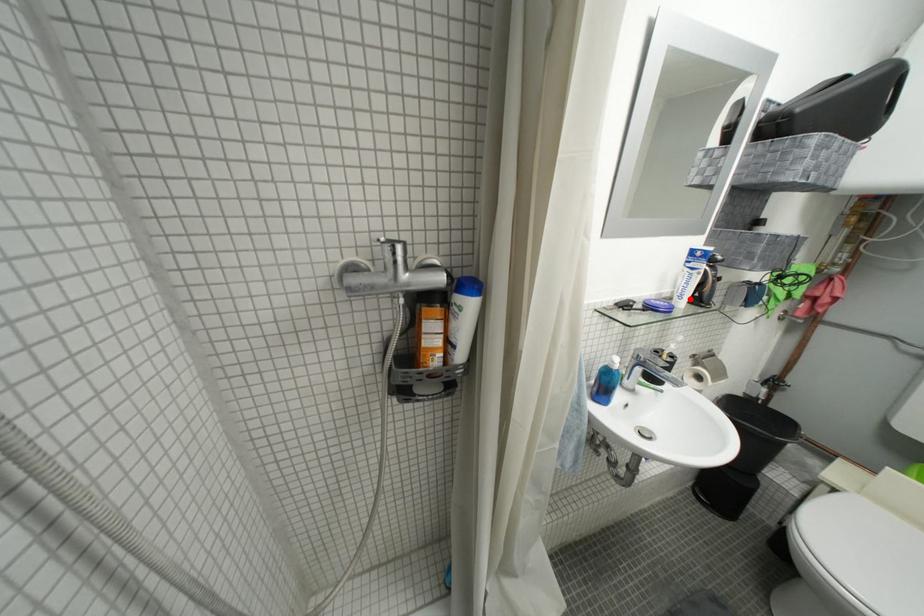
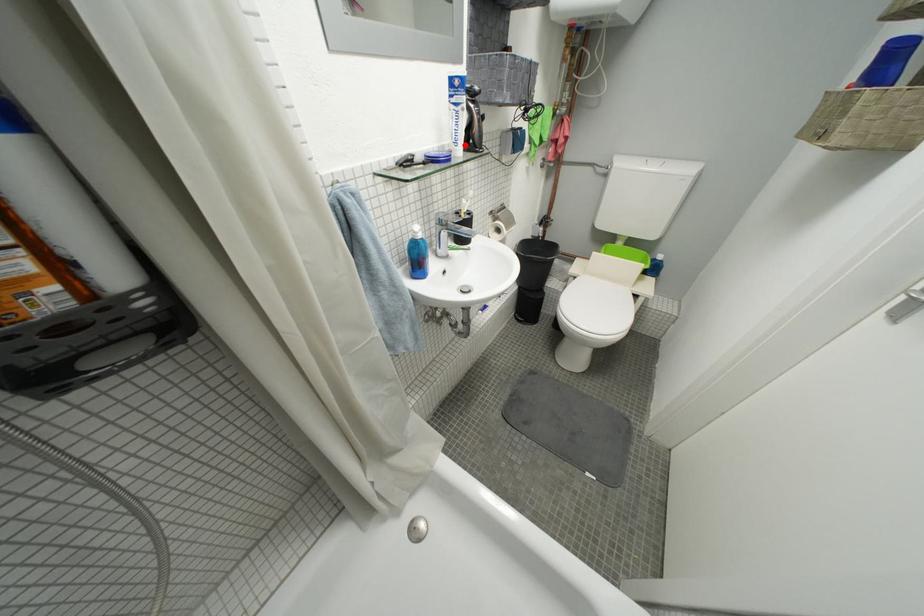
I am providing you with two images of the same scene from different viewpoints. A red point is marked on the first image and another point is marked on the second image. Is the red point in image1 aligned with the point shown in image2?

Yes